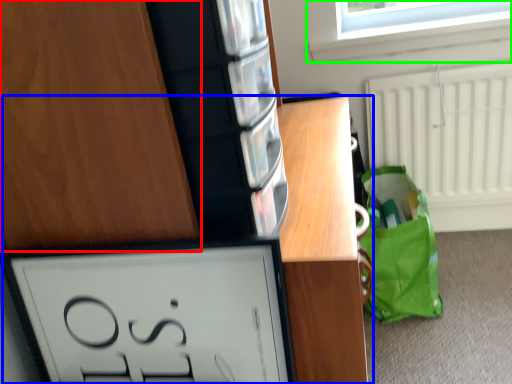
Question: Which object is the farthest from cabinetry (highlighted by a red box)? Choose among these: vanity (highlighted by a blue box) or window (highlighted by a green box).

Choices:
 (A) vanity
 (B) window

Answer: (B)